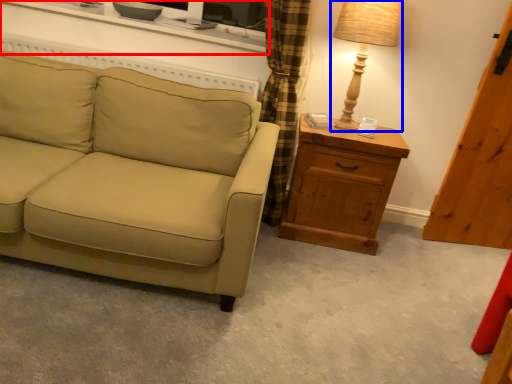
Question: Which object is further to the camera taking this photo, entertainment center (highlighted by a red box) or table lamp (highlighted by a blue box)?

Choices:
 (A) entertainment center
 (B) table lamp

Answer: (A)